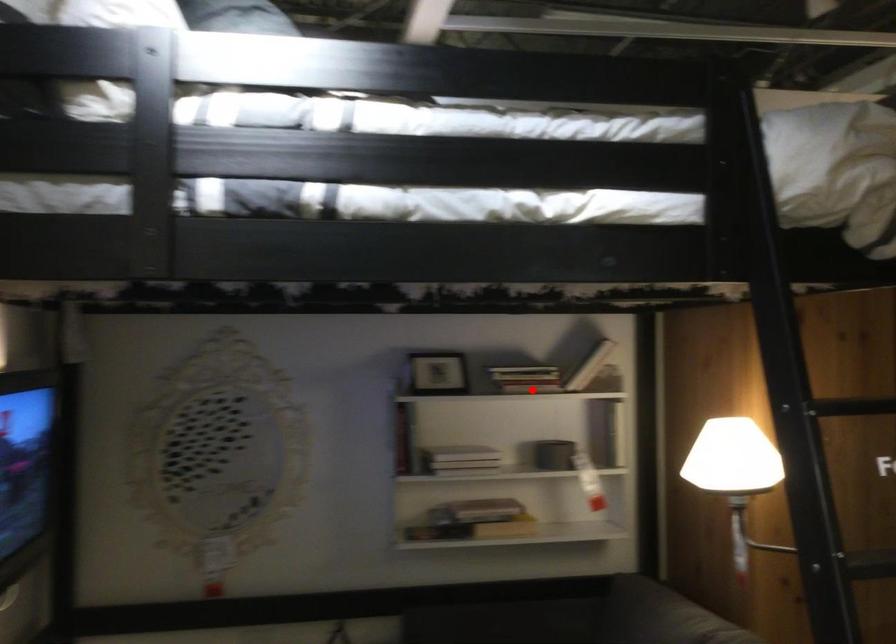
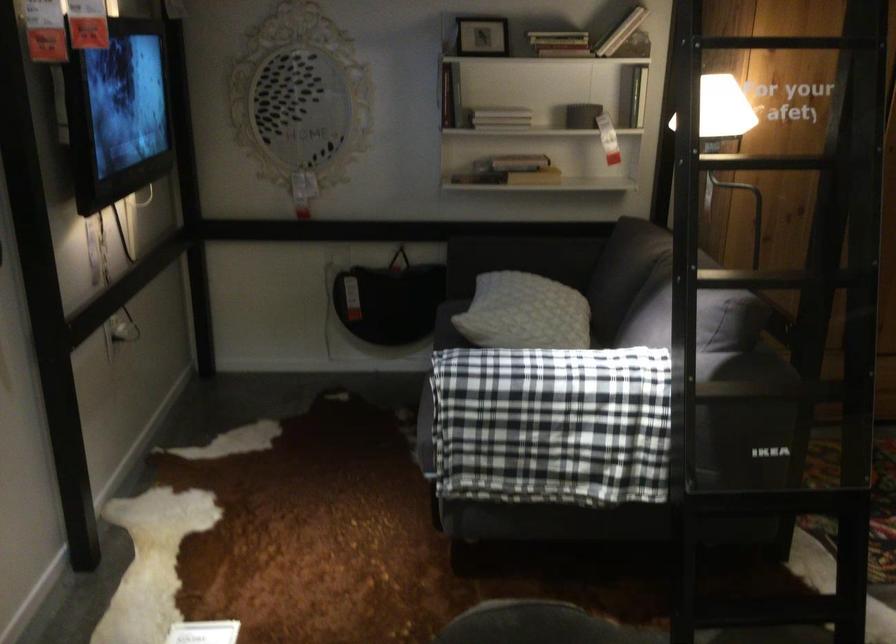
Find the pixel in the second image that matches the highlighted location in the first image.

(558, 43)